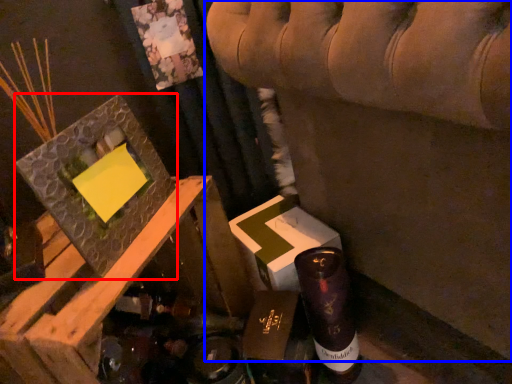
Question: Which object appears closest to the camera in this image, picture frame (highlighted by a red box) or furniture (highlighted by a blue box)?

Choices:
 (A) picture frame
 (B) furniture

Answer: (B)